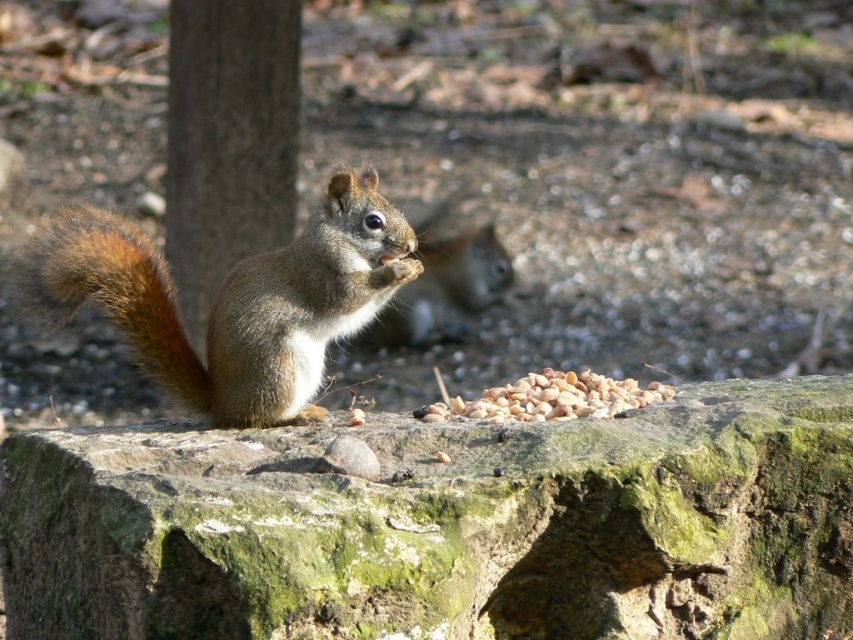
Based on the photo, you are a nature photographer trying to capture the brown fur squirrel at center and the brown furry tail at left in a single frame. Based on their positions, which one should you focus on first to ensure both are in focus?

The brown fur squirrel at center is in front of the brown furry tail at left, so you should focus on the brown fur squirrel at center first to ensure both are in focus.